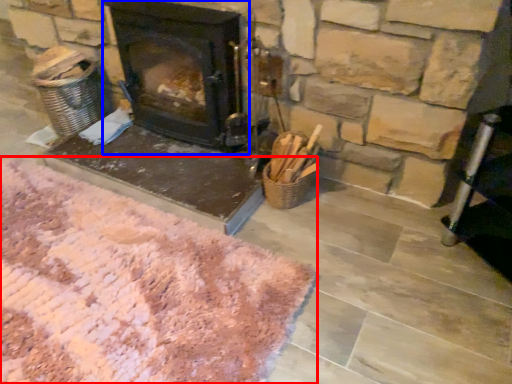
Question: Which of the following is the farthest to the observer, mat (highlighted by a red box) or wood burning stove (highlighted by a blue box)?

Choices:
 (A) mat
 (B) wood burning stove

Answer: (B)